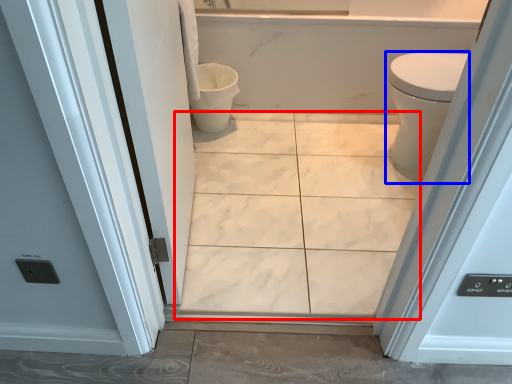
Question: Which point is further to the camera, ceramic tile (highlighted by a red box) or bidet (highlighted by a blue box)?

Choices:
 (A) ceramic tile
 (B) bidet

Answer: (B)